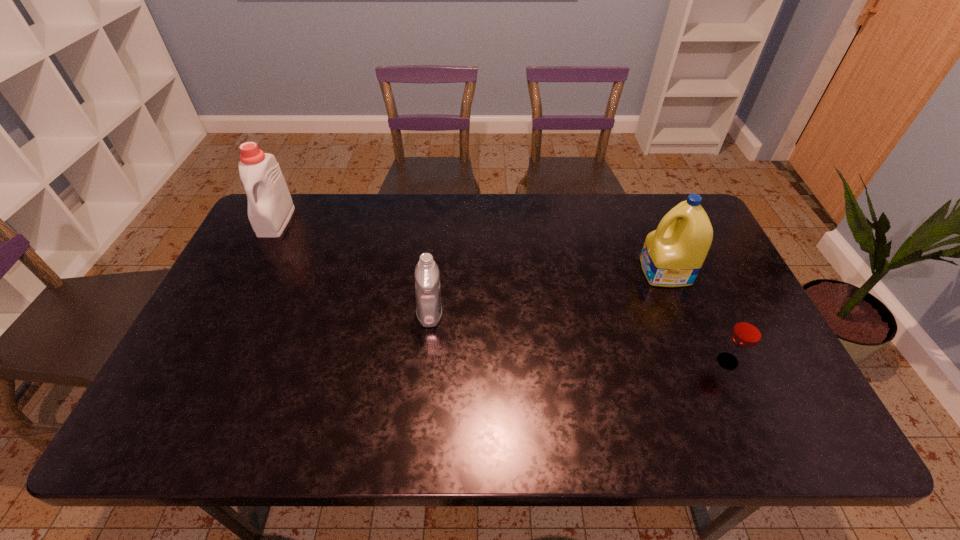
You are a GUI agent. You are given a task and a screenshot of the screen. Output one action in this format:
    pyautogui.click(x=<x>, y=<y>)
    Task: Click on the leftmost object
    The image size is (960, 540).
    Given the screenshot: What is the action you would take?
    pyautogui.click(x=270, y=207)

Identify the location of the leftmost detergent. (270, 207).

Locate an element on the screen. The height and width of the screenshot is (540, 960). the rightmost detergent is located at coordinates (672, 256).

You are a GUI agent. You are given a task and a screenshot of the screen. Output one action in this format:
    pyautogui.click(x=<x>, y=<y>)
    Task: Click on the second nearest detergent
    The height and width of the screenshot is (540, 960).
    Given the screenshot: What is the action you would take?
    pyautogui.click(x=672, y=256)

You are a GUI agent. You are given a task and a screenshot of the screen. Output one action in this format:
    pyautogui.click(x=<x>, y=<y>)
    Task: Click on the nearest detergent
    
    Given the screenshot: What is the action you would take?
    click(x=427, y=278)

Where is `the second nearest object`? The height and width of the screenshot is (540, 960). the second nearest object is located at coordinates (427, 278).

Locate an element on the screen. glass is located at coordinates (747, 332).

Locate an element on the screen. the shortest object is located at coordinates (747, 332).

Identify the location of free spot located on the handle side of the leftmost object. (241, 290).

Where is `free space located on the label of the second nearest detergent`? Image resolution: width=960 pixels, height=540 pixels. free space located on the label of the second nearest detergent is located at coordinates (553, 272).